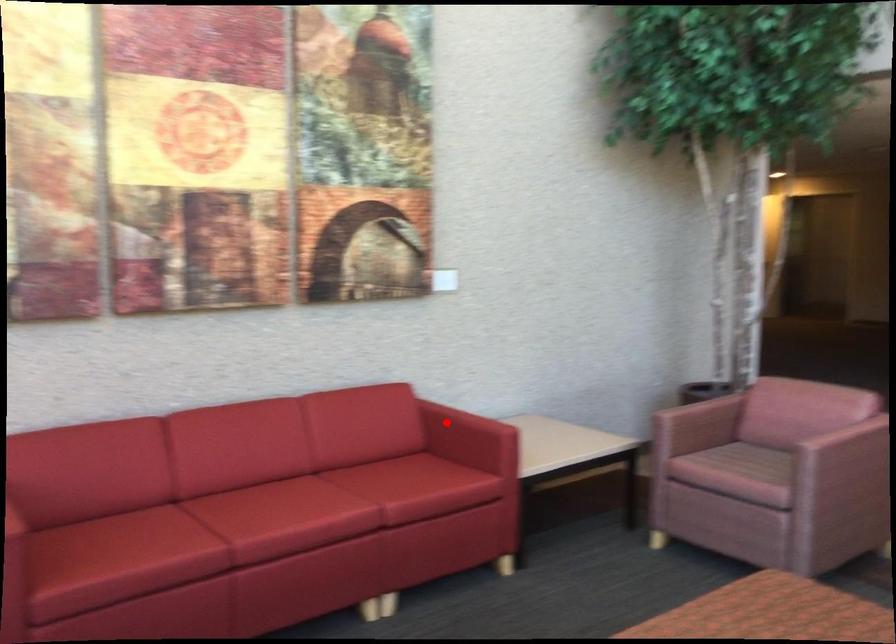
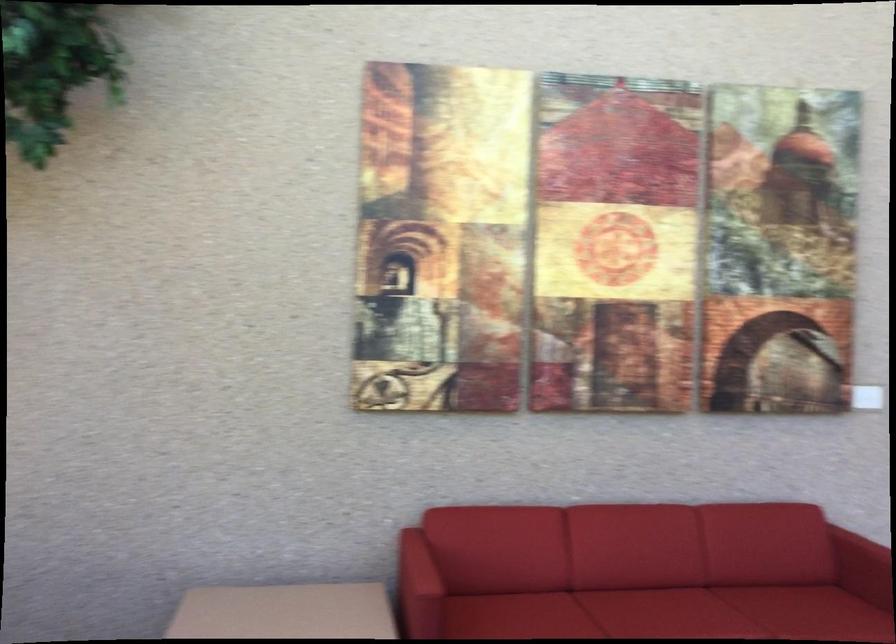
Locate, in the second image, the point that corresponds to the highlighted location in the first image.

(864, 558)